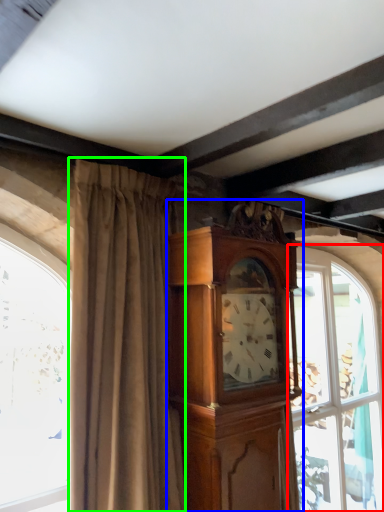
Question: Considering the real-world distances, which object is farthest from window (highlighted by a red box)? cabinetry (highlighted by a blue box) or curtain (highlighted by a green box)?

Choices:
 (A) cabinetry
 (B) curtain

Answer: (B)